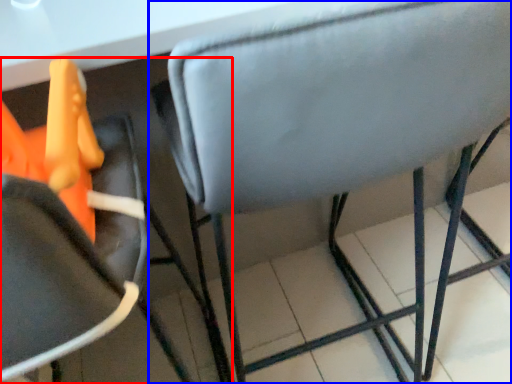
Question: Among these objects, which one is farthest to the camera, chair (highlighted by a red box) or chair (highlighted by a blue box)?

Choices:
 (A) chair
 (B) chair

Answer: (B)